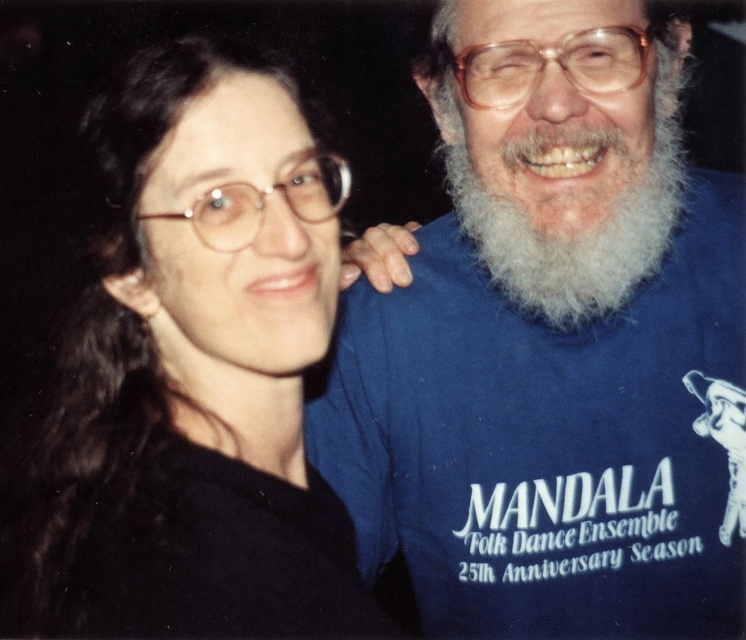
Between blue cotton t-shirt at right and white fluffy beard at upper right, which one appears on the left side from the viewer's perspective?

blue cotton t-shirt at right is more to the left.

Does blue cotton t-shirt at right appear under white fluffy beard at upper right?

Yes.

Which is in front, point (586, 449) or point (442, 106)?

Positioned in front is point (442, 106).

Identify the location of blue cotton t-shirt at right. The height and width of the screenshot is (640, 746). (551, 342).

Which of these two, blue cotton t-shirt at right or black matte shirt at left, stands shorter?

With less height is black matte shirt at left.

Is point (492, 509) more distant than point (275, 109)?

Yes.

Find the location of a particular element. blue cotton t-shirt at right is located at coordinates (551, 342).

Where is `blue cotton t-shirt at right`? blue cotton t-shirt at right is located at coordinates (551, 342).

Which is above, black matte shirt at left or white fluffy beard at upper right?

white fluffy beard at upper right is higher up.

Does black matte shirt at left have a larger size compared to white fluffy beard at upper right?

Correct, black matte shirt at left is larger in size than white fluffy beard at upper right.

Find the location of a particular element. black matte shirt at left is located at coordinates (195, 376).